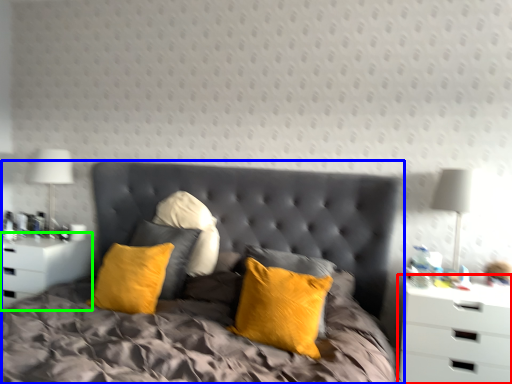
Question: Considering the real-world distances, which object is farthest from nightstand (highlighted by a red box)? bed (highlighted by a blue box) or nightstand (highlighted by a green box)?

Choices:
 (A) bed
 (B) nightstand

Answer: (B)